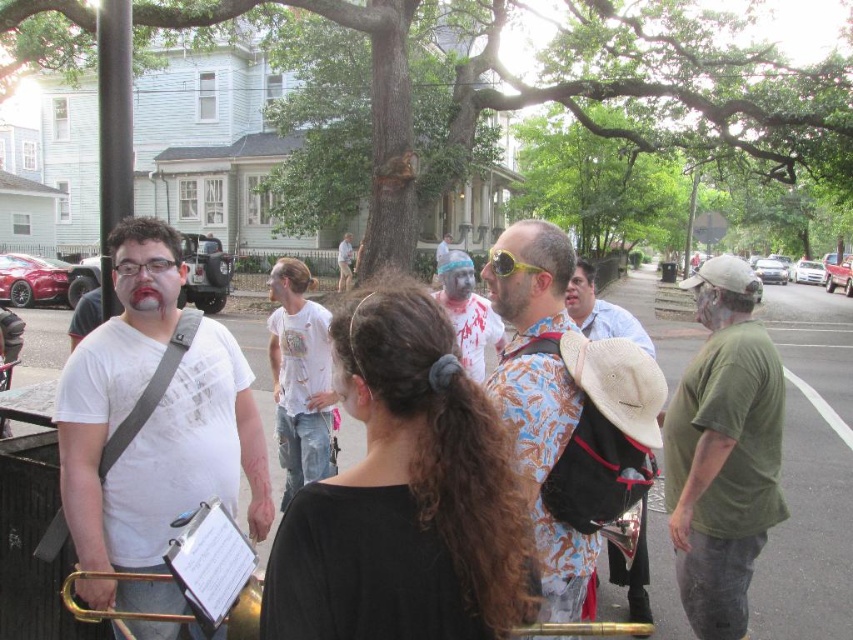
Looking at this image, you are standing at the starting point of the parade route and see two points marked in the image. The first point is at coordinates point (175, 612) and the second point is at point (352, 259). Which point is closer to you as you face the scene?

Point (175, 612) is in front of point (352, 259), so it is closer to you as you face the scene.